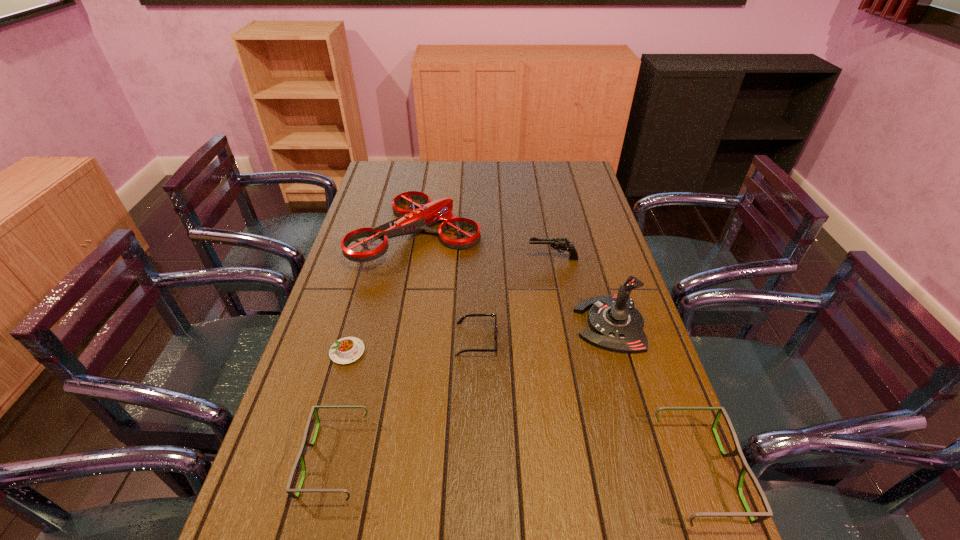
Identify the location of free point located at the end of the barrel of the gun. Image resolution: width=960 pixels, height=540 pixels. (462, 259).

This screenshot has width=960, height=540. Find the location of `free space located at the end of the barrel of the gun`. free space located at the end of the barrel of the gun is located at coordinates (429, 259).

Locate an element on the screen. Image resolution: width=960 pixels, height=540 pixels. vacant region located 0.050m at the end of the barrel of the gun is located at coordinates (513, 259).

The image size is (960, 540). I want to click on free region located 0.140m on the handle side of the joystick, so click(x=526, y=324).

At what (x,y) coordinates should I click in order to perform the action: click on vacant space located 0.400m on the handle side of the joystick. Please return your answer as a coordinate pair (x, y). Looking at the image, I should click on tap(435, 324).

Find the location of a particular element. Image resolution: width=960 pixels, height=540 pixels. vacant space situated on the handle side of the joystick is located at coordinates (494, 324).

You are a GUI agent. You are given a task and a screenshot of the screen. Output one action in this format:
    pyautogui.click(x=<x>, y=<y>)
    Task: Click on the free space located 0.310m on the back of the pudding
    The width and height of the screenshot is (960, 540).
    Given the screenshot: What is the action you would take?
    pyautogui.click(x=372, y=266)

Find the location of `spectacles present at the left edge`. spectacles present at the left edge is located at coordinates (300, 456).

You are a GUI agent. You are given a task and a screenshot of the screen. Output one action in this format:
    pyautogui.click(x=<x>, y=<y>)
    Task: Click on the drone located at the left edge
    Image resolution: width=960 pixels, height=540 pixels.
    Given the screenshot: What is the action you would take?
    pyautogui.click(x=412, y=221)

Find the location of a particular element. The height and width of the screenshot is (540, 960). pudding situated at the left edge is located at coordinates (348, 349).